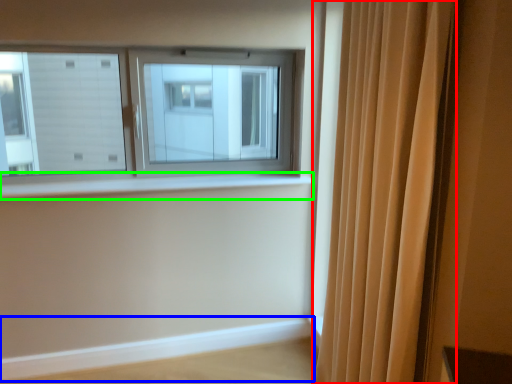
Question: Estimate the real-world distances between objects in this image. Which object is closer to curtain (highlighted by a red box), ledge (highlighted by a blue box) or window sill (highlighted by a green box)?

Choices:
 (A) ledge
 (B) window sill

Answer: (B)